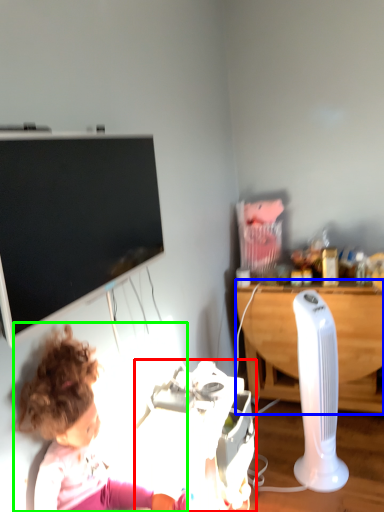
Question: Based on their relative distances, which object is nearer to equipment (highlighted by a red box)? Choose from desk (highlighted by a blue box) and person (highlighted by a green box).

Choices:
 (A) desk
 (B) person

Answer: (B)